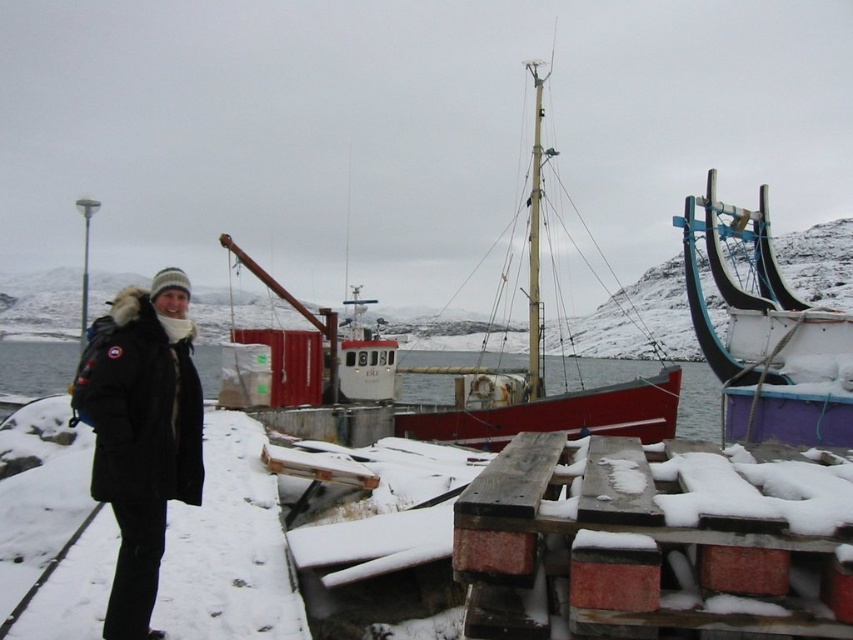
You are standing at the edge of the snowy dock and notice the black fuzzy coat at left and the clear water at center. Which object is closer to your right side?

The black fuzzy coat at left is to the right of clear water at center, so the black fuzzy coat at left is closer to your right side.

You are standing at the point with coordinates point (674, 410) and want to walk to the point with coordinates point (675, 554). Which direction should you move to reach your destination?

You should move forward because point (675, 554) is in front of point (674, 410).